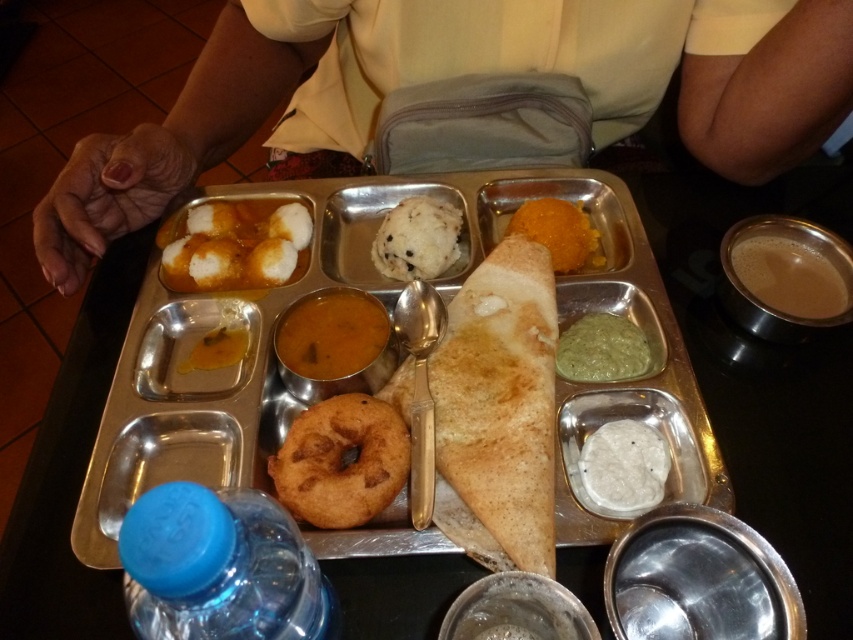
Can you confirm if brown matte curry at center is smaller than yellow matte curry at center?

Incorrect, brown matte curry at center is not smaller in size than yellow matte curry at center.

Measure the distance between brown matte curry at center and yellow matte curry at center.

brown matte curry at center and yellow matte curry at center are 6.65 centimeters apart from each other.

Where is `brown matte curry at center`? Image resolution: width=853 pixels, height=640 pixels. brown matte curry at center is located at coordinates 331,333.

You are a GUI agent. You are given a task and a screenshot of the screen. Output one action in this format:
    pyautogui.click(x=<x>, y=<y>)
    Task: Click on the brown matte curry at center
    The width and height of the screenshot is (853, 640).
    Given the screenshot: What is the action you would take?
    pyautogui.click(x=331, y=333)

Does golden crispy donut at center have a greater height compared to white matte idli at upper left?

Incorrect, golden crispy donut at center's height is not larger of white matte idli at upper left's.

Is point (270, 458) in front of point (254, 266)?

Yes, it is in front of point (254, 266).

Does point (329, 454) lie behind point (311, 221)?

No, (329, 454) is in front of (311, 221).

I want to click on golden crispy donut at center, so click(x=341, y=461).

Can you confirm if white matte idli at upper left is smaller than brown matte curry at center?

Incorrect, white matte idli at upper left is not smaller in size than brown matte curry at center.

Between white matte idli at upper left and brown matte curry at center, which one appears on the right side from the viewer's perspective?

brown matte curry at center

Identify the location of white matte idli at upper left. This screenshot has width=853, height=640. coord(235,244).